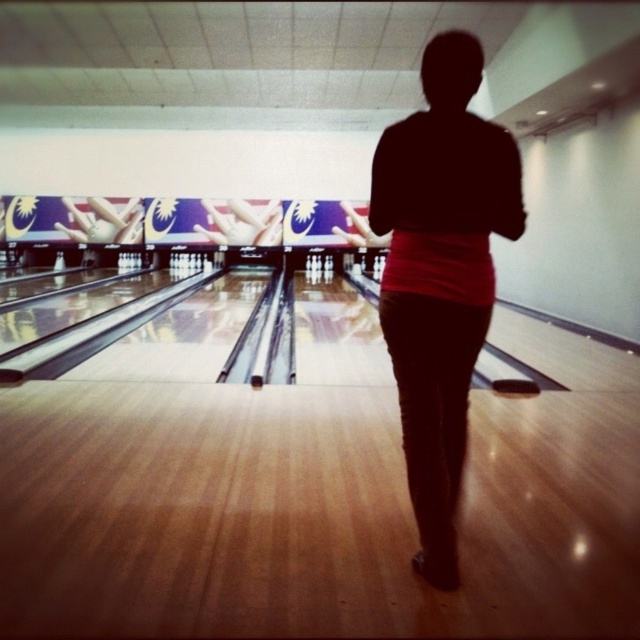
Between black matte shirt at center and white matte bowling ball at center, which one appears on the left side from the viewer's perspective?

white matte bowling ball at center is more to the left.

Measure the distance between black matte shirt at center and camera.

black matte shirt at center and camera are 6.14 feet apart from each other.

Is point (429, 563) behind point (221, 228)?

No, (429, 563) is closer to viewer.

Identify the location of black matte shirt at center. The width and height of the screenshot is (640, 640). (440, 275).